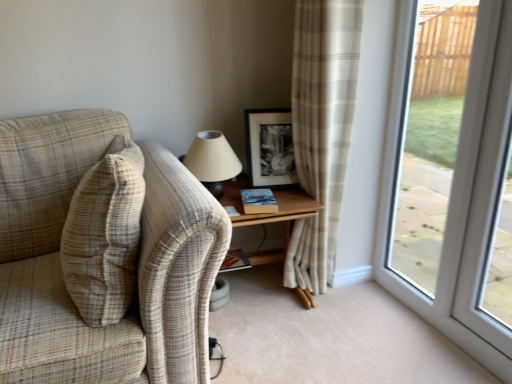
Find the location of a particular element. The width and height of the screenshot is (512, 384). free spot in front of beige plaid curtain at center is located at coordinates (329, 317).